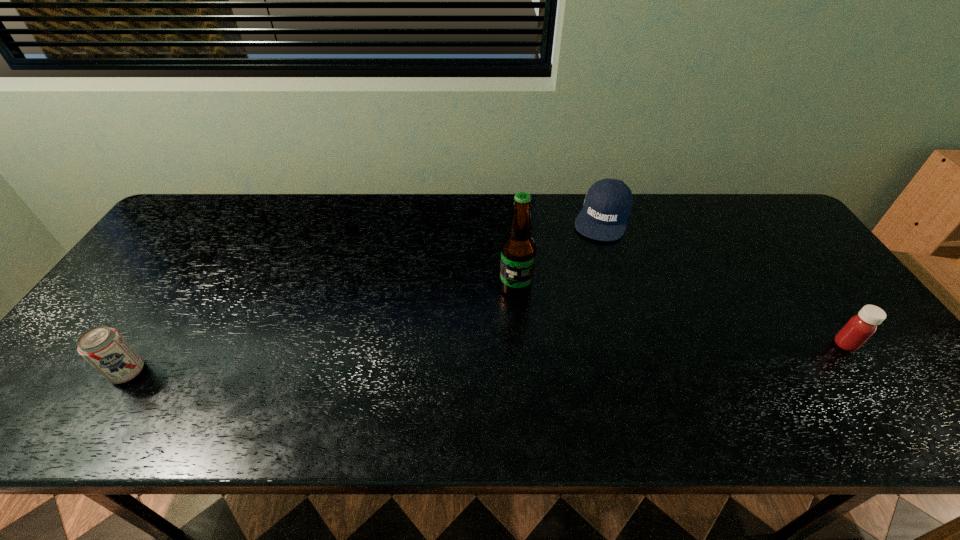
Where is `the nearest object`? the nearest object is located at coordinates (105, 349).

Identify the location of beer can. (105, 349).

Where is `the rightmost object`? Image resolution: width=960 pixels, height=540 pixels. the rightmost object is located at coordinates (861, 327).

The width and height of the screenshot is (960, 540). I want to click on the second nearest object, so click(x=861, y=327).

This screenshot has height=540, width=960. Find the location of `the tallest object`. the tallest object is located at coordinates (518, 250).

The height and width of the screenshot is (540, 960). I want to click on the third object from right to left, so click(518, 250).

Locate an element on the screen. The image size is (960, 540). baseball cap is located at coordinates (607, 206).

Image resolution: width=960 pixels, height=540 pixels. Identify the location of the second object from right to left. (607, 206).

Where is `blank space located on the right of the leftmost object`? Image resolution: width=960 pixels, height=540 pixels. blank space located on the right of the leftmost object is located at coordinates (236, 372).

Where is `vacant space located 0.260m on the left of the medicine`? The width and height of the screenshot is (960, 540). vacant space located 0.260m on the left of the medicine is located at coordinates (727, 344).